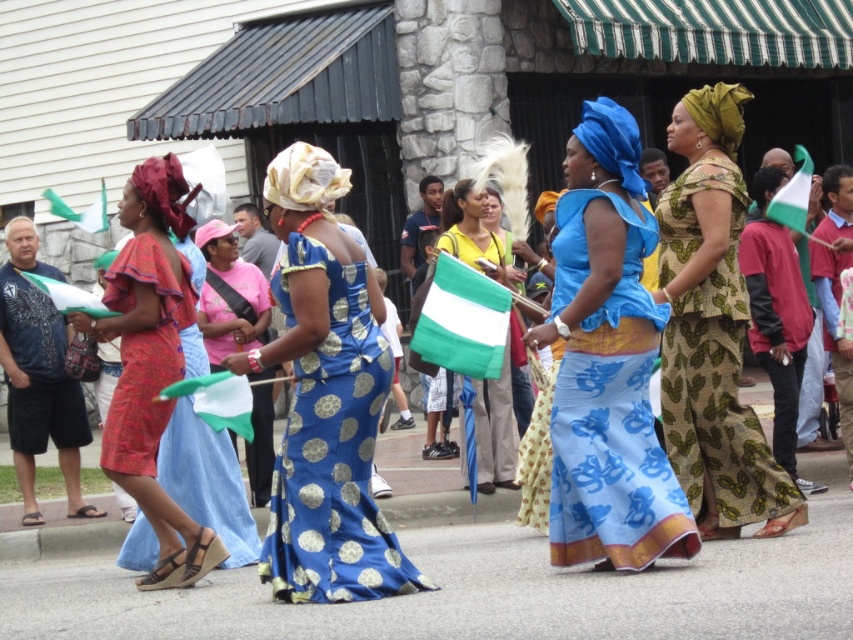
You are a photographer at the event and want to capture both the blue satin dress at center and the blue polka dot fabric dress at center in a single photo. Which dress should you focus on first to ensure both are in frame?

The blue satin dress at center is taller than the blue polka dot fabric dress at center, so focusing on the blue satin dress at center first will ensure both are in frame as the taller dress occupies more space.

You are a photographer at the event and want to capture both the blue printed dress at center and the blue polka dot fabric dress at center in the same frame. Which dress should you focus on first to ensure both are in the shot?

The blue printed dress at center is positioned on the right side of the blue polka dot fabric dress at center, so focusing on the blue polka dot fabric dress at center first will allow you to frame both dresses as the printed one is to its right.

You are a photographer standing on the sidewalk and want to take a photo of both the blue satin dress at center and the blue polka dot fabric dress at center. Which dress should you focus on first to ensure both are in clear focus?

You should focus on the blue satin dress at center first because it is closer to the viewer, and then adjust the focus to include the blue polka dot fabric dress at center, ensuring both are in clear focus.